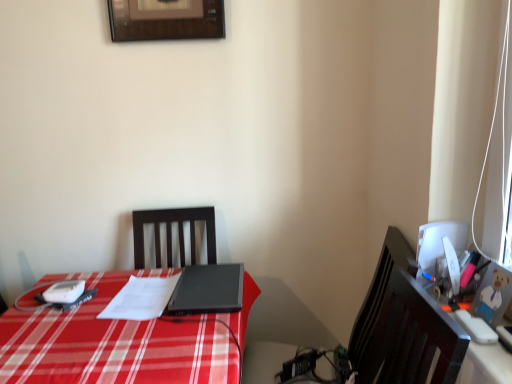
Question: From their relative heights in the image, would you say black matte laptop at center is taller or shorter than orange plastic toy at right?

Choices:
 (A) short
 (B) tall

Answer: (B)

Question: Does point (164, 311) appear closer or farther from the camera than point (475, 350)?

Choices:
 (A) closer
 (B) farther

Answer: (B)

Question: Estimate the real-world distances between objects in this image. Which object is farther from the white paper at center?

Choices:
 (A) white glossy computer monitor at right
 (B) black matte laptop at center
 (C) orange plastic toy at right

Answer: (C)

Question: Which is nearer to the white glossy computer monitor at right?

Choices:
 (A) black matte laptop at center
 (B) white paper at center
 (C) orange plastic toy at right

Answer: (C)